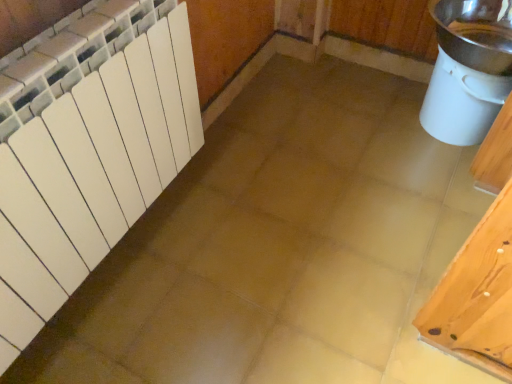
Locate an element on the screen. The image size is (512, 384). blank area to the left of white plastic bucket at right is located at coordinates (366, 129).